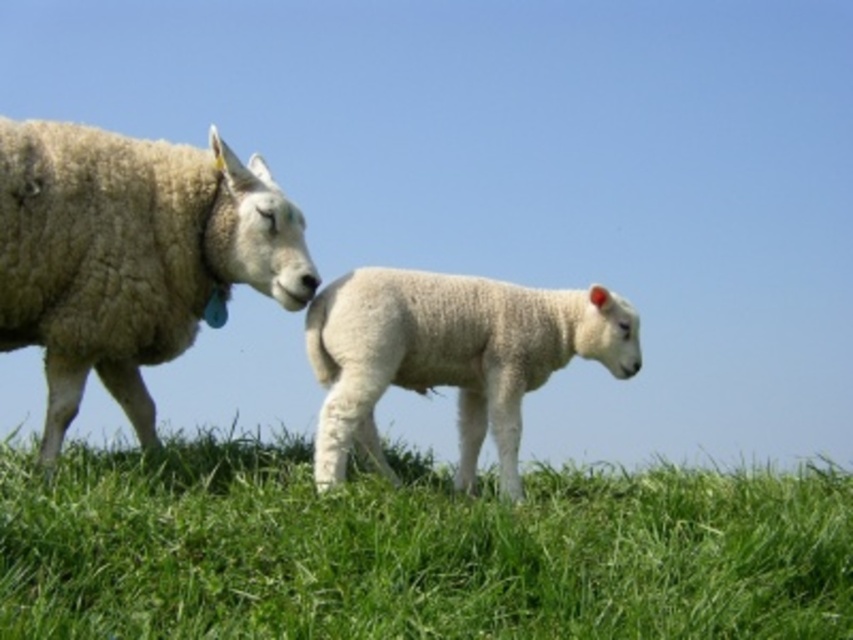
You are a farmer checking the pasture. You notice the green grassy at lower center and the white woolen lamb at center. Which one is wider?

The green grassy at lower center is wider than the white woolen lamb at center.

You are a farmer checking the pasture conditions. You notice the green grassy at lower center and the white woolen sheep at left. Which one has a lower height?

The green grassy at lower center is shorter than the white woolen sheep at left, so the green grassy at lower center has a lower height.

You are a drone operator trying to capture a photo of the two sheep on the grassy hill. The camera is currently focused on the point marked by the coordinate point at point [412,548]. To ensure both sheep are in the frame, should you adjust the camera to pan left or right?

The point marked by the coordinate point [412,548] is green grassy at lower center. Since the larger sheep is on the left and the smaller sheep is on the right, adjusting the camera to pan left would bring the larger sheep into view while keeping the smaller sheep in frame. Alternatively, panning right might move the focus away from the sheep entirely. To include both, centering between them would be better, but the question specifies left or right adjustment from the current point. Given the current aim